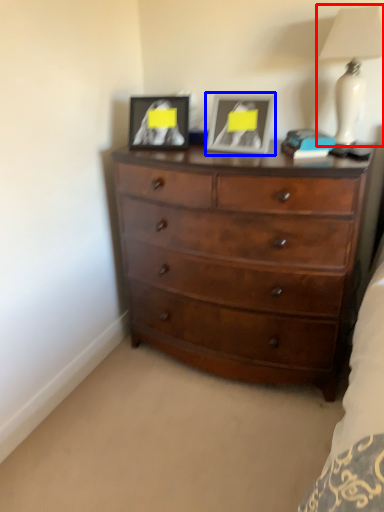
Question: Which object appears closest to the camera in this image, lamp (highlighted by a red box) or picture frame (highlighted by a blue box)?

Choices:
 (A) lamp
 (B) picture frame

Answer: (A)